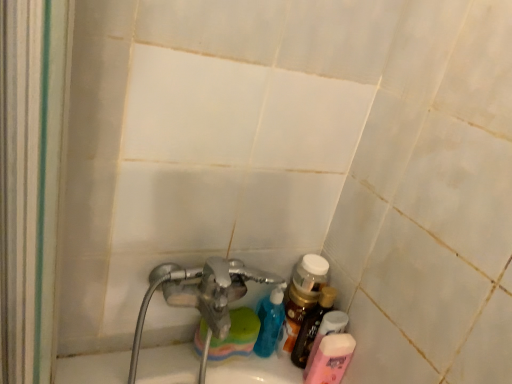
Question: Is pink matte lotion at lower right, marked as the first toiletry in a bottom-to-top arrangement, shorter than translucent plastic bottle at lower right, placed as the 2th toiletry when sorted from bottom to top?

Choices:
 (A) yes
 (B) no

Answer: (A)

Question: Does pink matte lotion at lower right, marked as the first toiletry in a bottom-to-top arrangement, appear on the left side of translucent plastic bottle at lower right, placed as the 2th toiletry when sorted from bottom to top?

Choices:
 (A) no
 (B) yes

Answer: (A)

Question: Is pink matte lotion at lower right, marked as the first toiletry in a bottom-to-top arrangement, oriented towards translucent plastic bottle at lower right, placed as the 2th toiletry when sorted from bottom to top?

Choices:
 (A) yes
 (B) no

Answer: (B)

Question: Is pink matte lotion at lower right, marked as the first toiletry in a bottom-to-top arrangement, positioned far away from translucent plastic bottle at lower right, the 1th toiletry when ordered from top to bottom?

Choices:
 (A) no
 (B) yes

Answer: (A)

Question: Is translucent plastic bottle at lower right, the 1th toiletry when ordered from top to bottom, at the back of pink matte lotion at lower right, marked as the first toiletry in a bottom-to-top arrangement?

Choices:
 (A) no
 (B) yes

Answer: (A)

Question: Is translucent plastic bottle at lower right, the 1th toiletry when ordered from top to bottom, a part of pink matte lotion at lower right, the 2th toiletry positioned from the top?

Choices:
 (A) no
 (B) yes

Answer: (A)

Question: From a real-world perspective, is translucent plastic bottle at lower right over pink matte lotion at lower right, the 2th toiletry positioned from the top?

Choices:
 (A) yes
 (B) no

Answer: (A)

Question: Is translucent plastic bottle at lower right behind pink matte lotion at lower right, marked as the first toiletry in a bottom-to-top arrangement?

Choices:
 (A) yes
 (B) no

Answer: (A)

Question: Considering the relative sizes of translucent plastic bottle at lower right and pink matte lotion at lower right, marked as the first toiletry in a bottom-to-top arrangement, in the image provided, is translucent plastic bottle at lower right bigger than pink matte lotion at lower right, marked as the first toiletry in a bottom-to-top arrangement,?

Choices:
 (A) yes
 (B) no

Answer: (B)

Question: Is translucent plastic bottle at lower right next to pink matte lotion at lower right, marked as the first toiletry in a bottom-to-top arrangement?

Choices:
 (A) no
 (B) yes

Answer: (B)

Question: Considering the relative sizes of translucent plastic bottle at lower right and pink matte lotion at lower right, the 2th toiletry positioned from the top, in the image provided, is translucent plastic bottle at lower right wider than pink matte lotion at lower right, the 2th toiletry positioned from the top,?

Choices:
 (A) yes
 (B) no

Answer: (B)

Question: Is translucent plastic bottle at lower right positioned with its back to pink matte lotion at lower right, marked as the first toiletry in a bottom-to-top arrangement?

Choices:
 (A) no
 (B) yes

Answer: (A)

Question: Could you tell me if translucent plastic bottle at lower right, placed as the 2th toiletry when sorted from bottom to top, is facing pink matte lotion at lower right, marked as the first toiletry in a bottom-to-top arrangement?

Choices:
 (A) yes
 (B) no

Answer: (B)